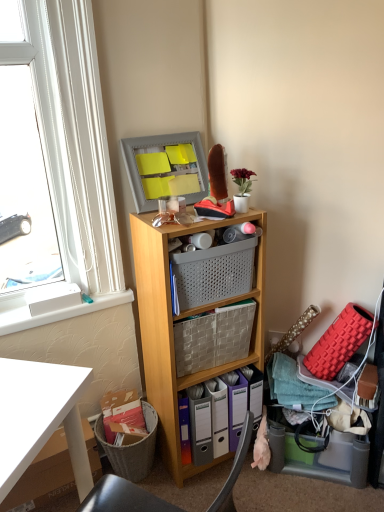
At what (x,y) coordinates should I click in order to perform the action: click on blank area beneath white plastic window at upper left (from a real-world perspective). Please return your answer as a coordinate pair (x, y). This screenshot has height=512, width=384. Looking at the image, I should click on (71, 302).